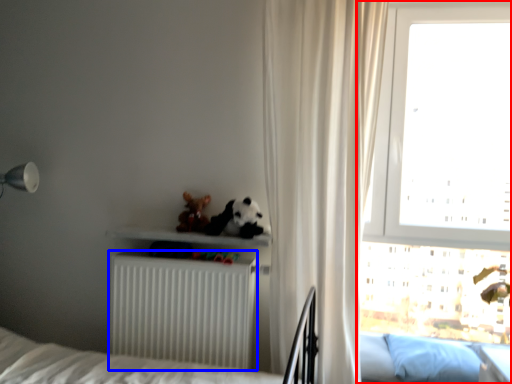
Question: Which object appears farthest to the camera in this image, window (highlighted by a red box) or radiator (highlighted by a blue box)?

Choices:
 (A) window
 (B) radiator

Answer: (A)